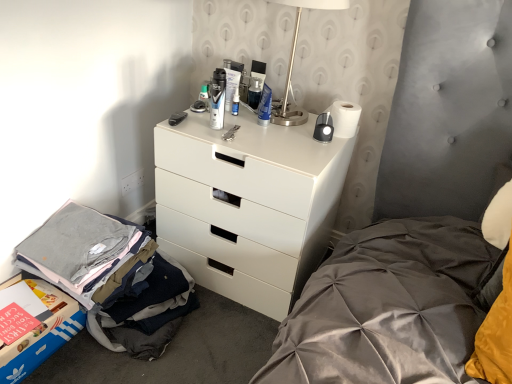
Where is `vacant area that lies to the right of matte plastic tube at upper center, marked as the 3th toiletry in a right-to-left arrangement`? Image resolution: width=512 pixels, height=384 pixels. vacant area that lies to the right of matte plastic tube at upper center, marked as the 3th toiletry in a right-to-left arrangement is located at coordinates (272, 117).